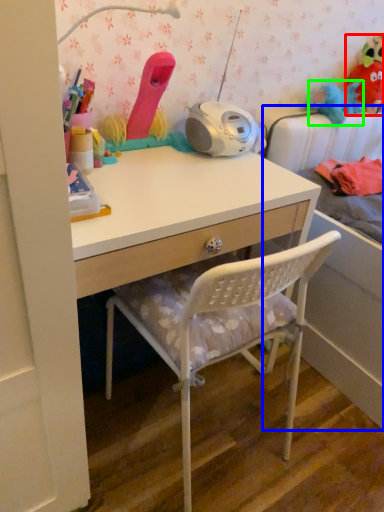
Question: Based on their relative distances, which object is farther from toy (highlighted by a red box)? Choose from bed (highlighted by a blue box) and toy (highlighted by a green box).

Choices:
 (A) bed
 (B) toy

Answer: (A)